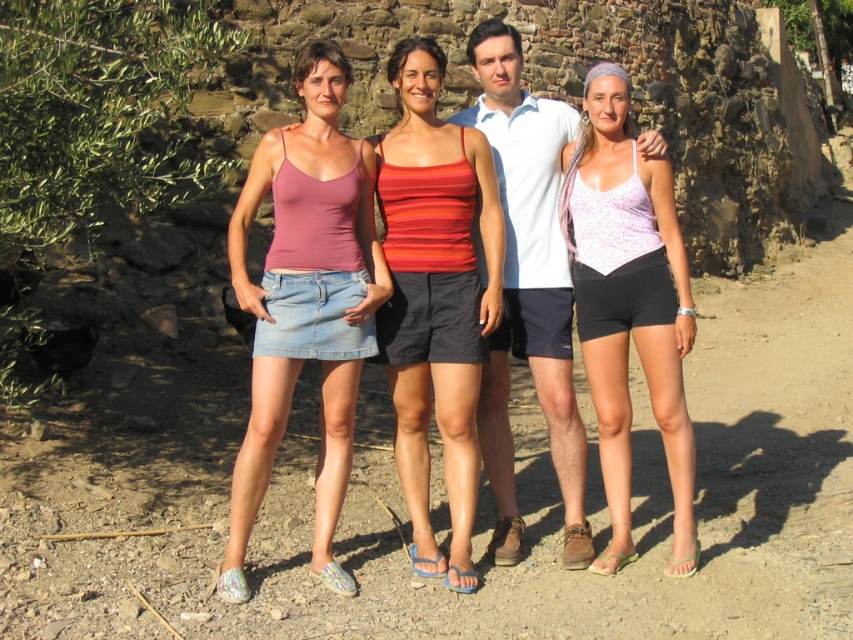
Question: Is matte purple tank top at center smaller than striped cotton tank top at center?

Choices:
 (A) no
 (B) yes

Answer: (A)

Question: Is pink denim skirt at lower left closer to the viewer compared to matte purple tank top at center?

Choices:
 (A) no
 (B) yes

Answer: (B)

Question: Which is farther from the matte purple tank top at center?

Choices:
 (A) purple floral tank top at center
 (B) striped cotton tank top at center
 (C) pink denim skirt at lower left

Answer: (A)

Question: Does purple floral tank top at center have a larger size compared to white cotton shirt at center?

Choices:
 (A) no
 (B) yes

Answer: (A)

Question: Based on their relative distances, which object is farther from the pink denim skirt at lower left?

Choices:
 (A) matte purple tank top at center
 (B) white cotton shirt at center
 (C) purple floral tank top at center
 (D) striped cotton tank top at center

Answer: (C)

Question: Which object is positioned closest to the purple floral tank top at center?

Choices:
 (A) pink denim skirt at lower left
 (B) matte purple tank top at center
 (C) striped cotton tank top at center
 (D) white cotton shirt at center

Answer: (D)